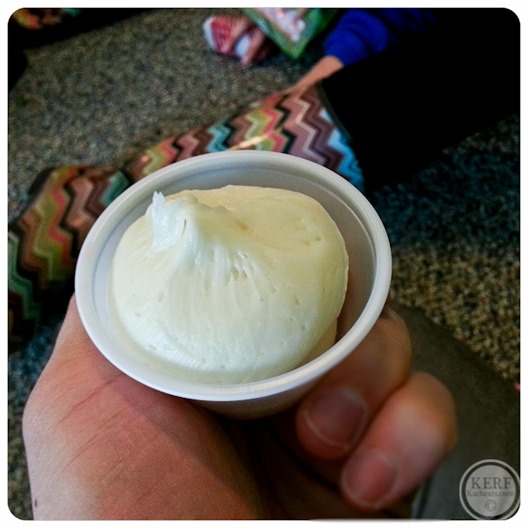
This screenshot has height=528, width=528. In order to click on black carpet in this screenshot , I will do `click(156, 103)`.